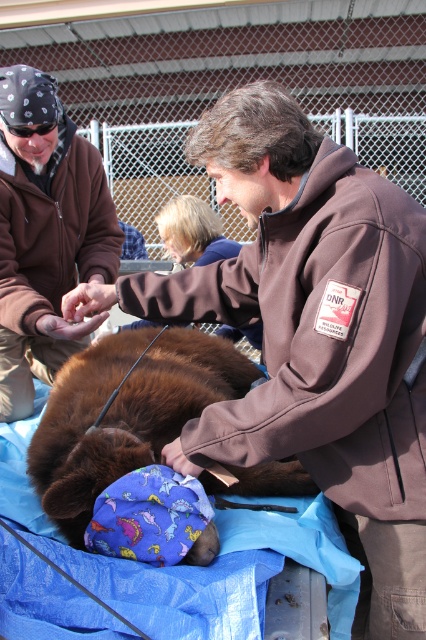
You are a wildlife researcher observing the scene. You notice the brown suede jacket at upper left and the black rubber goggles at upper left. Which item is positioned lower in the image?

The brown suede jacket at upper left is located below the black rubber goggles at upper left, so the brown suede jacket at upper left is positioned lower.

You are a wildlife researcher who needs to safely approach the brown suede jacket at upper left and the brown furry bear at center. Given that the minimum safe distance for a human to be near a restrained bear is 24 inches, can you safely approach both objects simultaneously without violating the safety guideline?

The brown suede jacket at upper left and brown furry bear at center are 22.87 inches apart from each other. Since the minimum safe distance is 24 inches, approaching both simultaneously would violate the safety guideline as the distance is less than required.

You are a wildlife researcher observing the scene. You need to determine the spatial relationship between the brown suede jacket at upper left and the brown furry bear at center. Which object is positioned higher in the image?

The brown suede jacket at upper left is located above the brown furry bear at center, so it is positioned higher in the image.